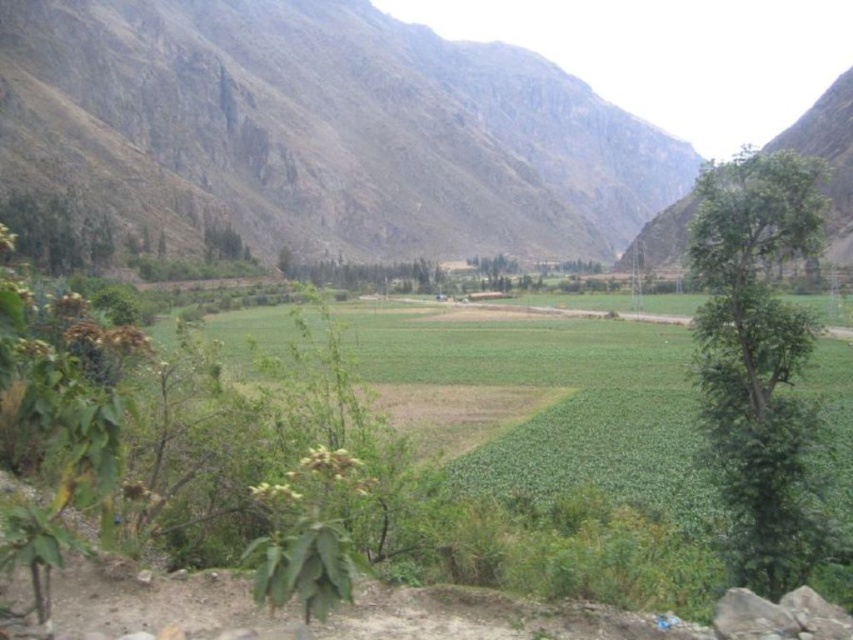
Question: Which point is closer to the camera taking this photo?

Choices:
 (A) (550, 81)
 (B) (328, 280)
 (C) (740, 372)

Answer: (C)

Question: Which of these objects is positioned closest to the green leafy tree at center?

Choices:
 (A) green leafy tree at right
 (B) brown rocky mountain at upper center

Answer: (B)

Question: From the image, what is the correct spatial relationship of brown rocky mountain at upper center in relation to green leafy tree at right?

Choices:
 (A) below
 (B) above

Answer: (B)

Question: Among these objects, which one is nearest to the camera?

Choices:
 (A) green leafy tree at center
 (B) green leafy tree at right

Answer: (B)

Question: Can you confirm if brown rocky mountain at upper center is smaller than green leafy tree at center?

Choices:
 (A) yes
 (B) no

Answer: (B)

Question: Does brown rocky mountain at upper center have a larger size compared to green leafy tree at center?

Choices:
 (A) no
 (B) yes

Answer: (B)